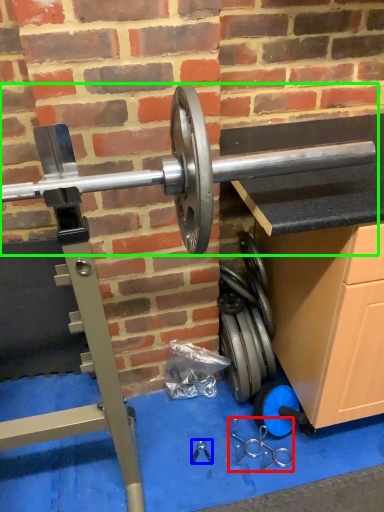
Question: Considering the real-world distances, which object is farthest from tool (highlighted by a red box)? tool (highlighted by a blue box) or barbell (highlighted by a green box)?

Choices:
 (A) tool
 (B) barbell

Answer: (B)